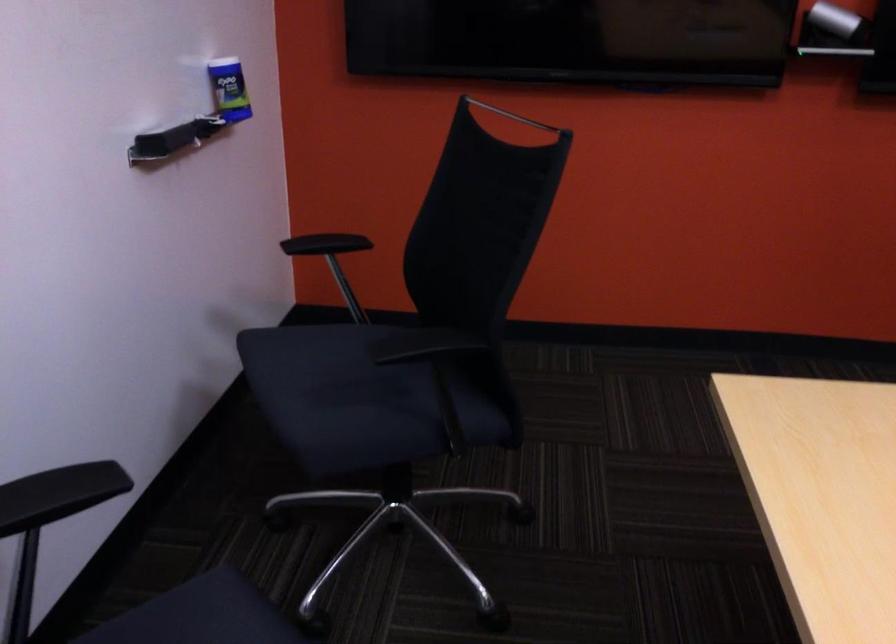
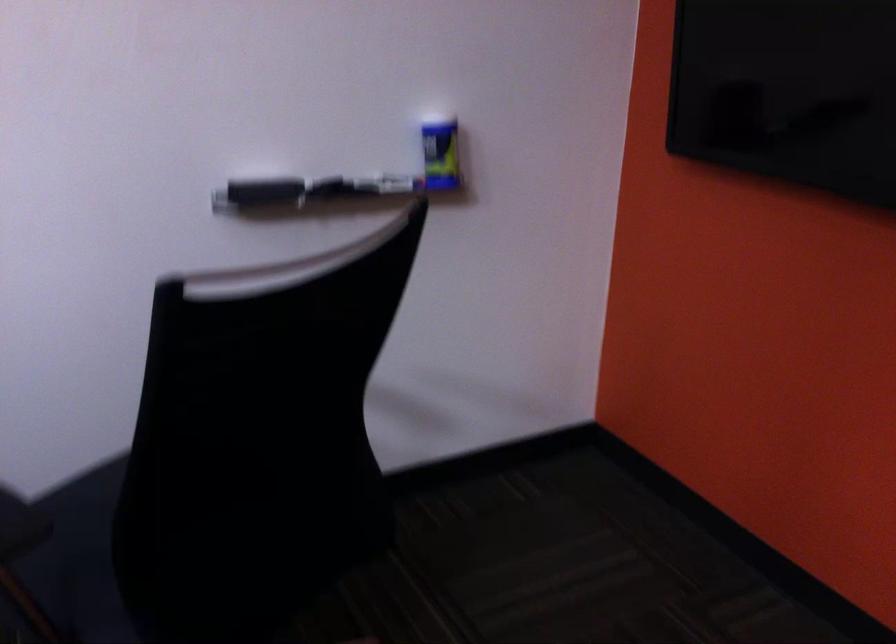
Where in the second image is the point corresponding to [194,126] from the first image?

(355, 181)